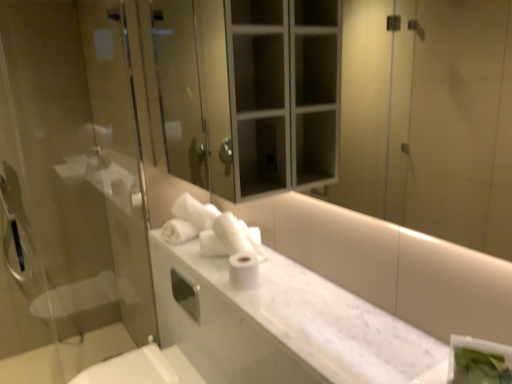
The image size is (512, 384). Identify the location of free space to the back side of white matte toilet paper at center. (232, 271).